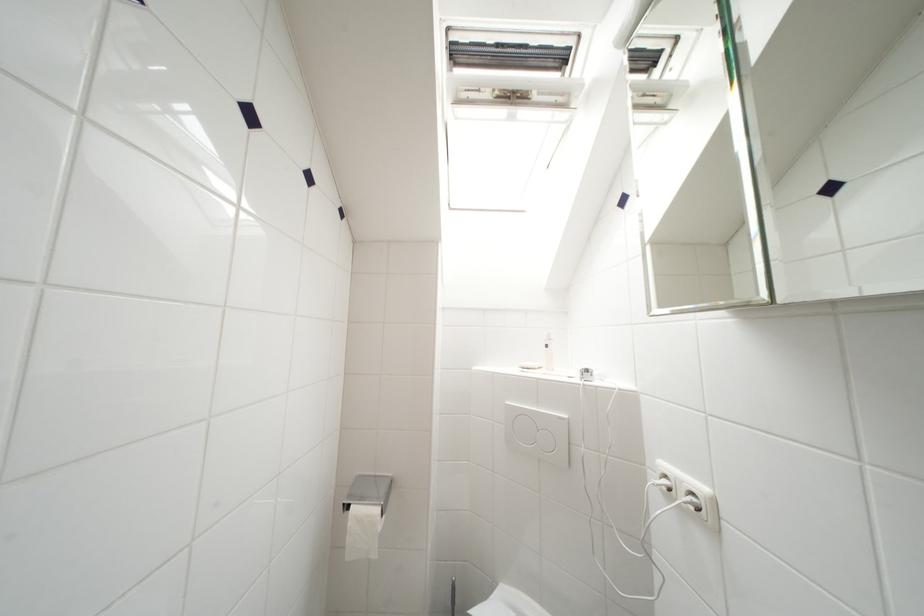
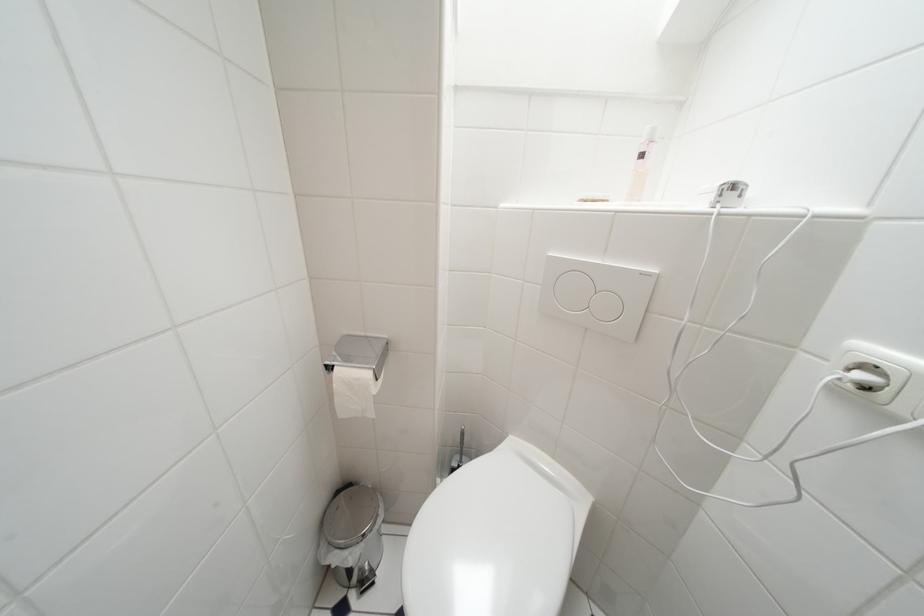
Question: The images are taken continuously from a first-person perspective. In which direction is your viewpoint rotating?

Choices:
 (A) Left
 (B) Right
 (C) Up
 (D) Down

Answer: (D)